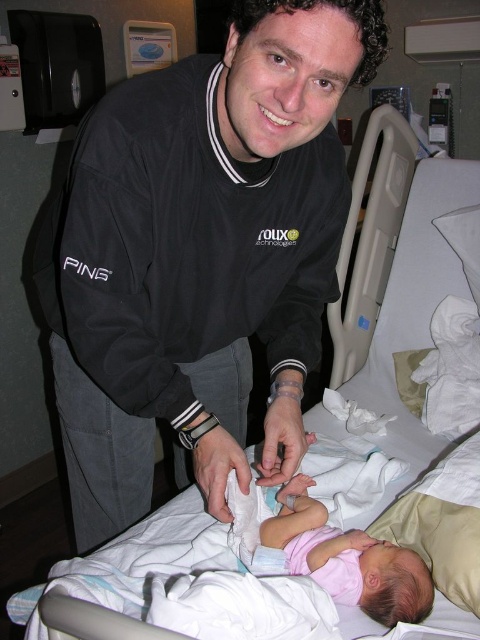
Looking at this image, you are a nurse in the hospital room and need to check the baby. The black soft jacket at center and the pink fabric baby at center are in your line of sight. Which object is located to the left of the other?

The black soft jacket at center is positioned on the left side of pink fabric baby at center.